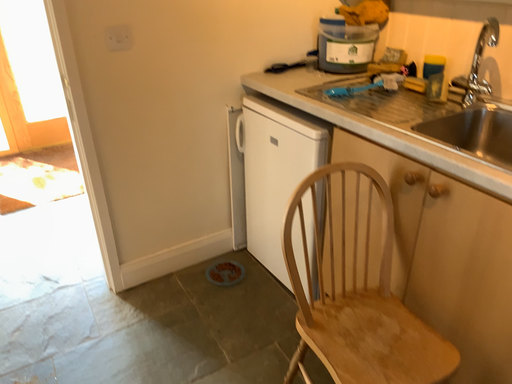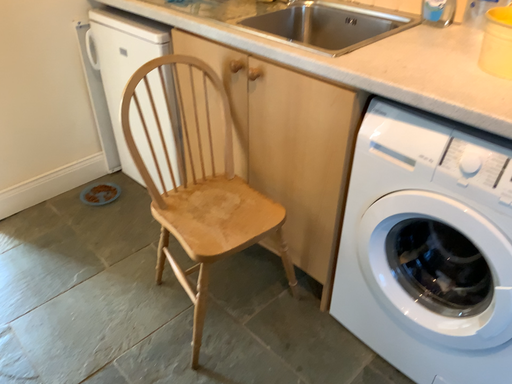
Question: Which way did the camera rotate in the video?

Choices:
 (A) rotated upward
 (B) rotated downward

Answer: (B)